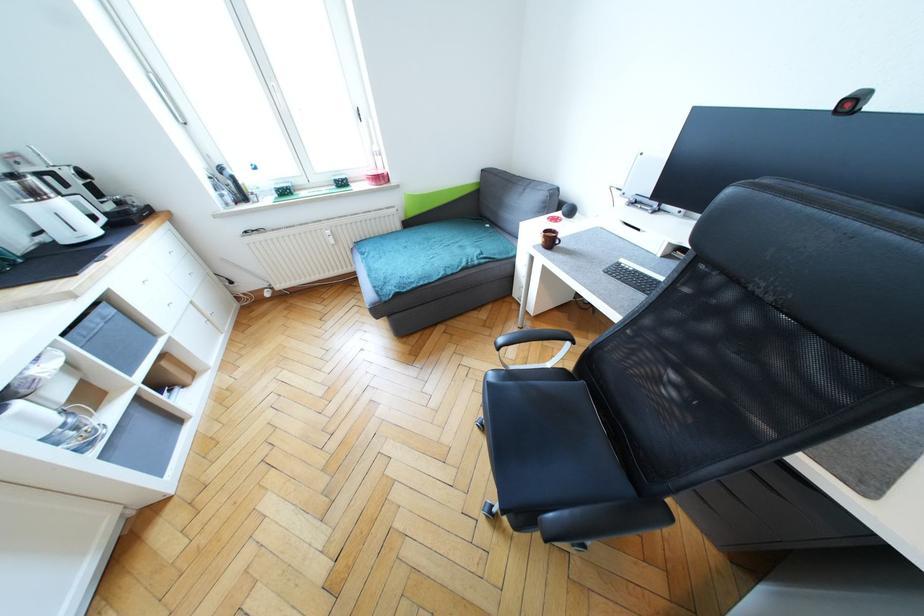
Image resolution: width=924 pixels, height=616 pixels. I want to click on red and black webcam, so click(853, 102).